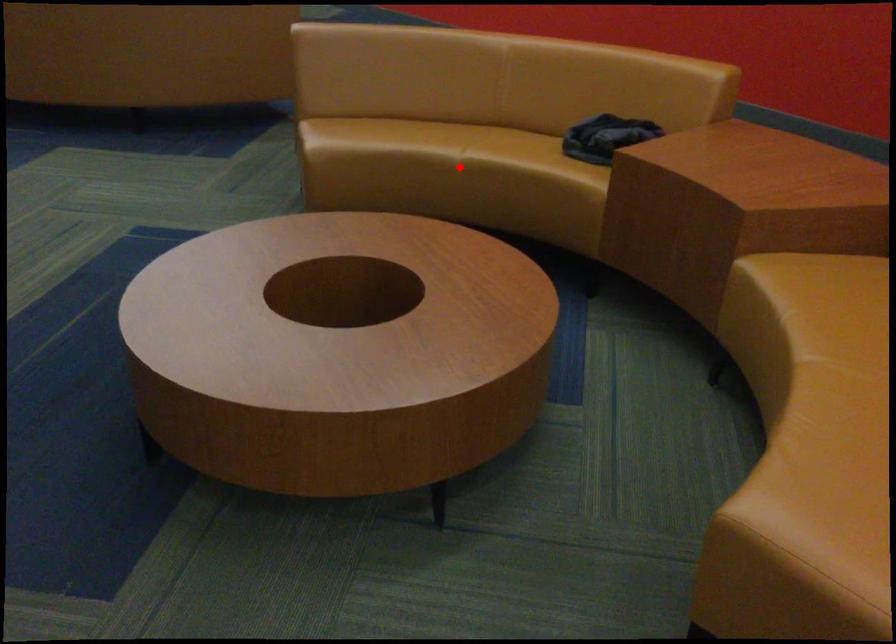
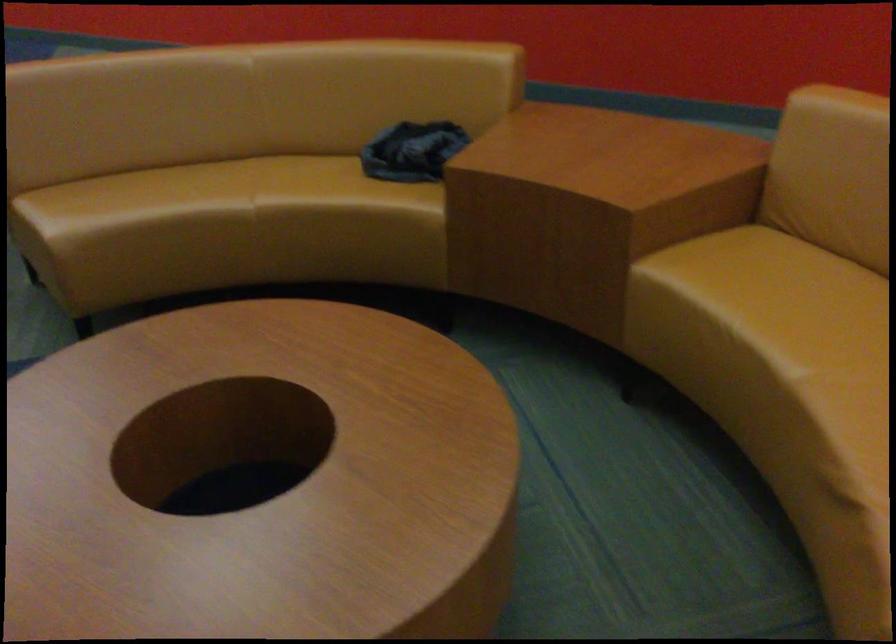
Question: I am providing you with two images of the same scene from different viewpoints. A red point is shown in image1. For the corresponding object point in image2, is it positioned nearer or farther from the camera?

Choices:
 (A) Nearer
 (B) Farther

Answer: (A)